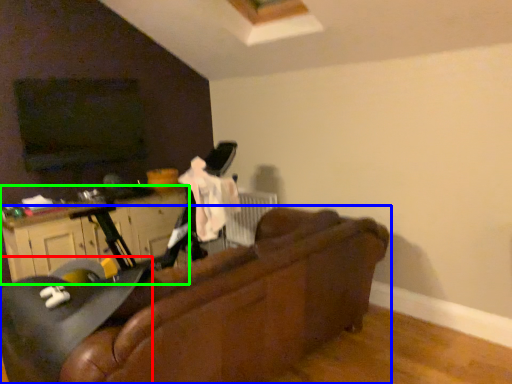
Question: Considering the real-world distances, which object is closest to swivel chair (highlighted by a red box)? studio couch (highlighted by a blue box) or dresser (highlighted by a green box).

Choices:
 (A) studio couch
 (B) dresser

Answer: (A)